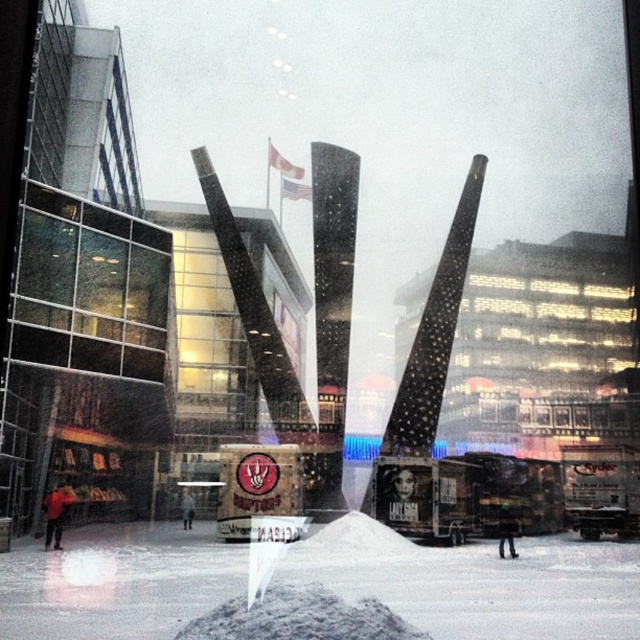
Does white powdery snow at lower center have a smaller size compared to gray gravel mound at center?

No.

Who is positioned more to the left, white powdery snow at lower center or gray gravel mound at center?

gray gravel mound at center is more to the left.

Where is `white powdery snow at lower center`? This screenshot has width=640, height=640. white powdery snow at lower center is located at coordinates (477, 582).